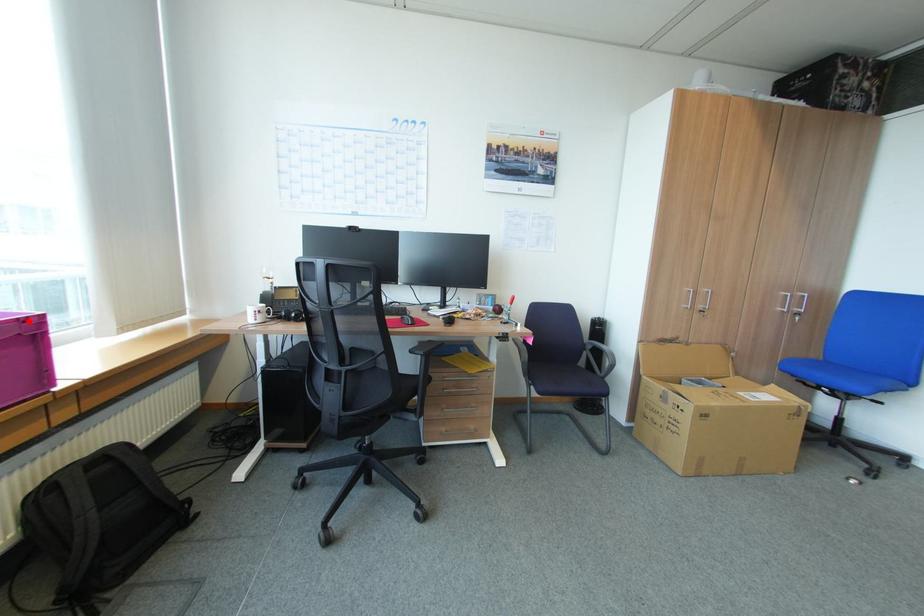
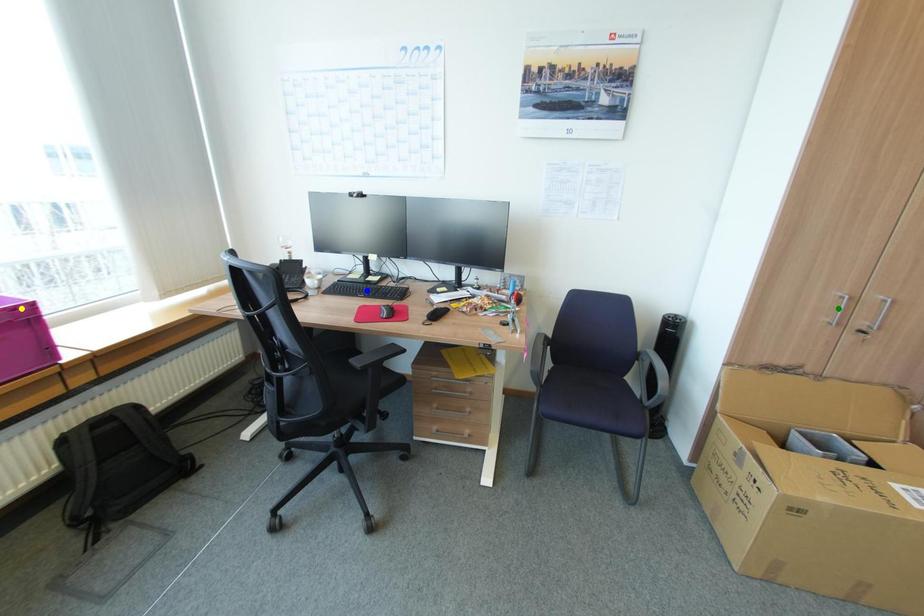
Question: I am providing you with two images of the same scene from different viewpoints. A red point is marked on the first image. You are given multiple points on the second image. Which spot in image 2 lines up with the point in image 1?

Choices:
 (A) blue point
 (B) green point
 (C) yellow point

Answer: (C)